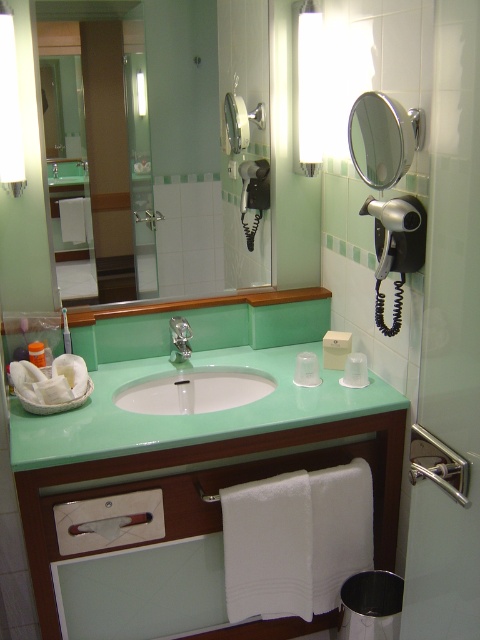
You are trying to place a 16 inch long decorative item between the white fabric hand towel at lower center and the clear plastic cup at center on the bathroom vanity. Will there be enough space?

The distance between the white fabric hand towel at lower center and the clear plastic cup at center is 15.93 inches, so the 16 inch decorative item will not fit between them as it is slightly longer than the available space.

You are designing a layout for a bathroom magazine spread and need to know if the metallic circular mirror at upper right can fit horizontally next to the satin nickel faucet at sink center. Can you confirm if the mirror is narrower than the faucet?

The metallic circular mirror at upper right might be wider than satin nickel faucet at sink center, so it may not fit horizontally next to it without overlapping or requiring more space.